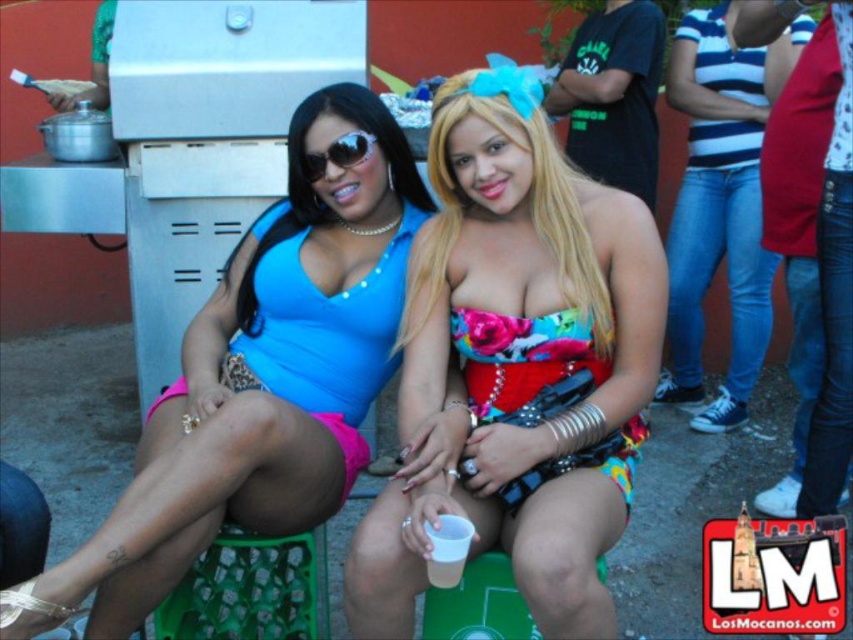
You are organizing a photoshoot and need to ensure that the floral fabric dress at center and the sunglasses at center fit within a rectangular frame. Based on their widths, which object should be placed closer to the edge of the frame to ensure both fit?

The sunglasses at center should be placed closer to the edge of the frame because the floral fabric dress at center is wider than the sunglasses at center, requiring more space.

You are a photographer at the event and want to capture a closeup of the floral strapless dress at center without the sunglasses at center blocking the view. Is the dress positioned in a way that allows this?

The floral strapless dress at center is located below the sunglasses at center, so the sunglasses are above the dress. Therefore, the dress can be captured without obstruction from the sunglasses as they are positioned higher up.

You are standing at the point with coordinates point (550, 321) and want to move towards the point with coordinates point (270, 422). Based on the scene, which direction should you move to reach your destination?

To move from point (550, 321) to point (270, 422), you should move forward since point (270, 422) is in front of point (550, 321).